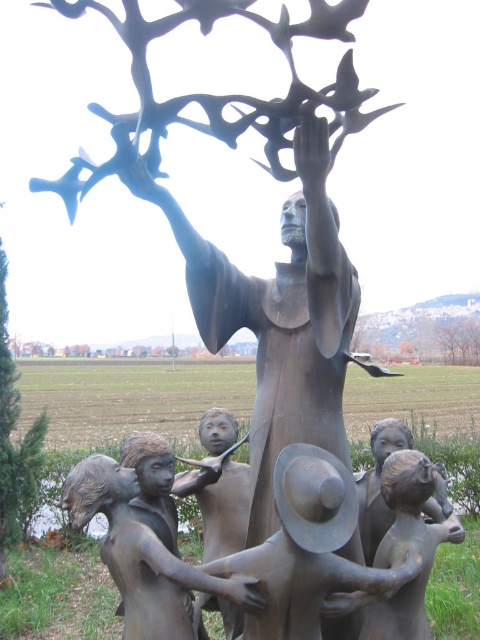
Question: Does green leafy tree at left appear on the left side of brown wood tree at upper center?

Choices:
 (A) yes
 (B) no

Answer: (A)

Question: Among these points, which one is farthest from the camera?

Choices:
 (A) (296, 532)
 (B) (477, 339)
 (C) (25, 468)
 (D) (469, 349)

Answer: (B)

Question: Is brushed metal hat at lower center further to the viewer compared to brown wood tree at upper center?

Choices:
 (A) yes
 (B) no

Answer: (B)

Question: Can you confirm if green matte tree at upper center is bigger than brown wood tree at upper center?

Choices:
 (A) no
 (B) yes

Answer: (B)

Question: Which object is closer to the camera taking this photo?

Choices:
 (A) brushed metal hat at lower center
 (B) brown wood tree at upper center
 (C) green matte tree at upper center

Answer: (A)

Question: Which point is closer to the camera taking this photo?

Choices:
 (A) click(464, 326)
 (B) click(14, 493)
 (C) click(335, 531)
 (D) click(412, 340)

Answer: (C)